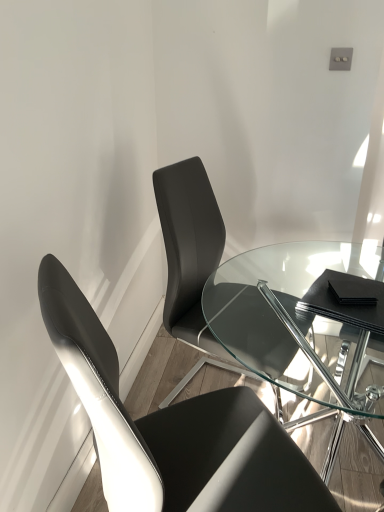
Question: Considering the positions of transparent glass table at center and matte black chair at center, positioned as the 1th chair in back-to-front order, in the image, is transparent glass table at center bigger or smaller than matte black chair at center, positioned as the 1th chair in back-to-front order,?

Choices:
 (A) small
 (B) big

Answer: (B)

Question: From the image's perspective, relative to matte black chair at center, acting as the 2th chair starting from the front, is transparent glass table at center above or below?

Choices:
 (A) below
 (B) above

Answer: (A)

Question: Estimate the real-world distances between objects in this image. Which object is farther from the black leather chair at left, the 2th chair viewed from the back?

Choices:
 (A) transparent glass table at center
 (B) matte black chair at center, acting as the 2th chair starting from the front

Answer: (A)

Question: Considering the real-world distances, which object is closest to the matte black chair at center, acting as the 2th chair starting from the front?

Choices:
 (A) black leather chair at left, the 2th chair viewed from the back
 (B) transparent glass table at center

Answer: (B)